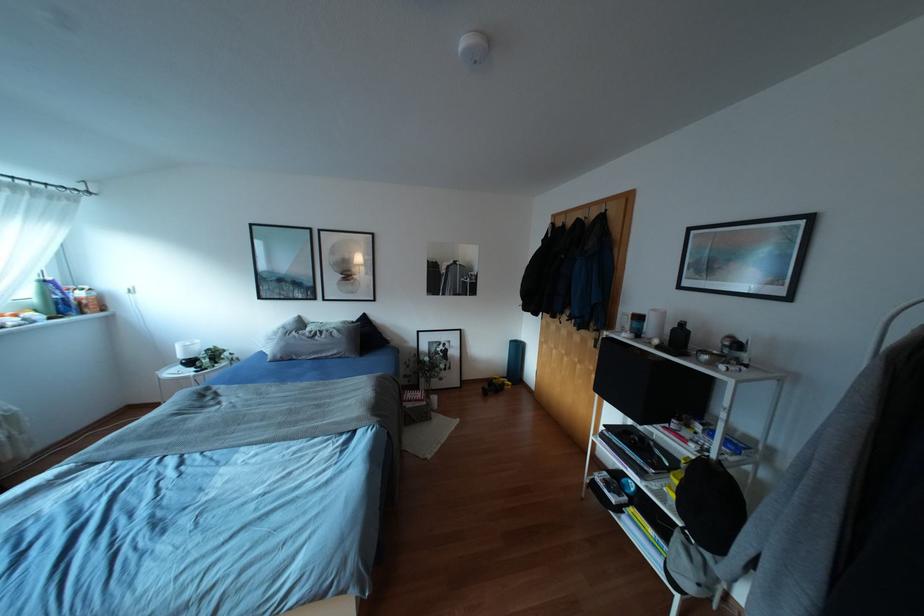
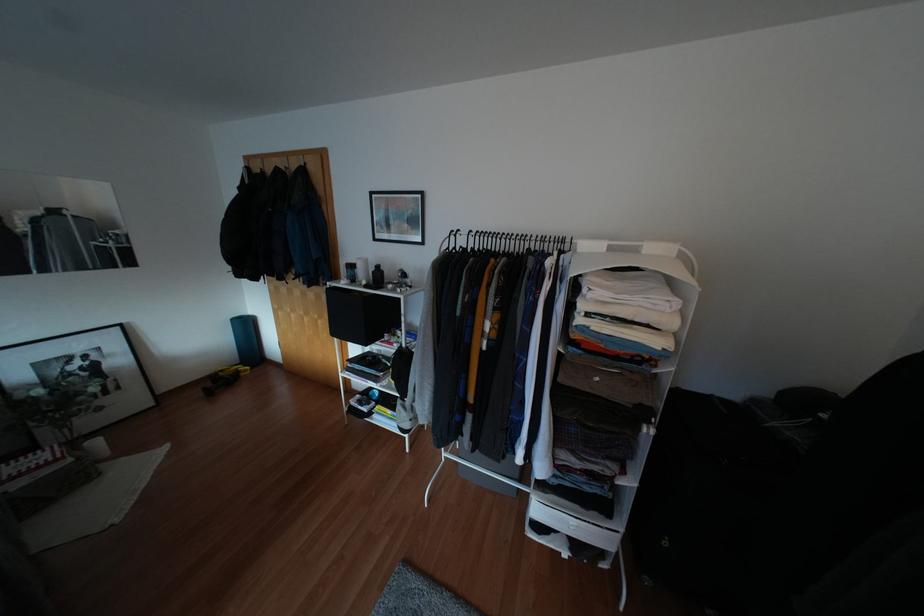
Find the pixel in the second image that matches point 433,398 in the first image.

(94, 442)